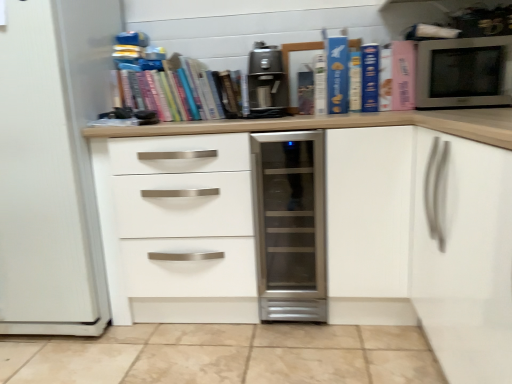
Where is `free spot in front of pink matte book at upper right, acting as the sixth paperback book starting from the left`? This screenshot has height=384, width=512. free spot in front of pink matte book at upper right, acting as the sixth paperback book starting from the left is located at coordinates (392, 112).